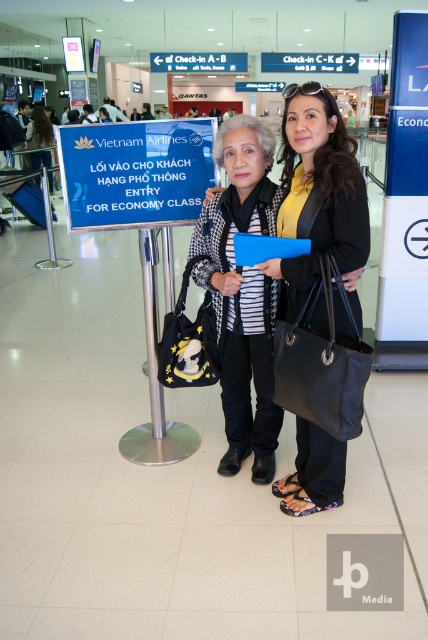
You are an airport security officer inspecting luggage. You notice two handbags at the center of the security checkpoint. The handbags are labeled as the black leather handbag at center and the matte black handbag at center. Which handbag takes up less space?

The black leather handbag at center occupies less space than the matte black handbag at center according to the description.

You are a security guard at the airport. You need to check the contents of both the black textured coat at center and the matte black handbag at center. Which one should you ask the passenger to place on the Xray machine first?

The black textured coat at center is in front of the matte black handbag at center, so you should ask the passenger to place the black textured coat at center first to avoid blocking the view of the handbag during the scan.